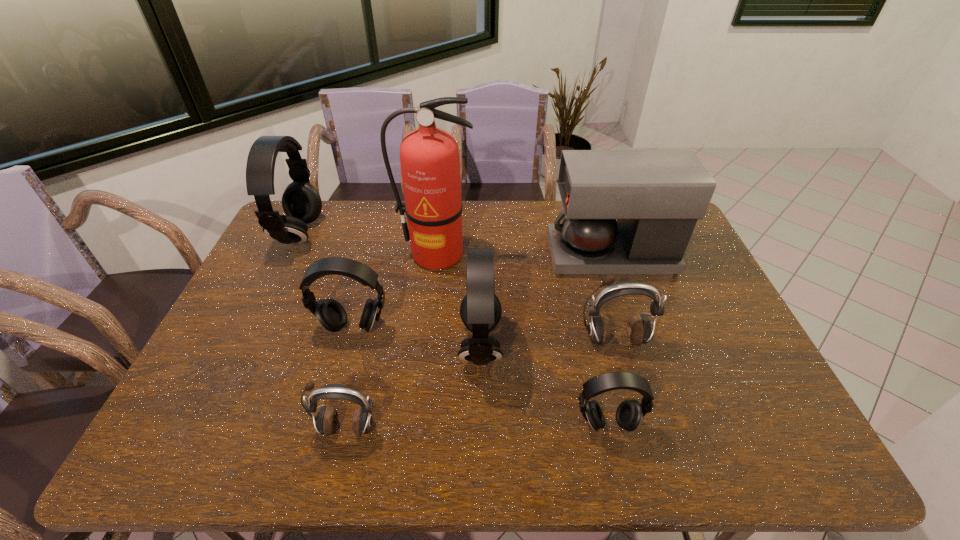
Find the location of a particular element. The height and width of the screenshot is (540, 960). black earphone that is the third closest one to the smaller brown earphone is located at coordinates (629, 413).

Identify the location of free space that satisfies the following two spatial constraints: 1. on the carafe side of the coffee maker; 2. on the ear cups of the smallest black earphone. This screenshot has height=540, width=960. (667, 423).

The width and height of the screenshot is (960, 540). Find the location of `free space that satisfies the following two spatial constraints: 1. on the ear cups of the third smallest black earphone; 2. on the ear pads of the nearer brown earphone`. free space that satisfies the following two spatial constraints: 1. on the ear cups of the third smallest black earphone; 2. on the ear pads of the nearer brown earphone is located at coordinates (481, 428).

Find the location of a particular element. The height and width of the screenshot is (540, 960). free spot that satisfies the following two spatial constraints: 1. on the ear pads of the farther brown earphone; 2. on the ear cups of the third smallest black earphone is located at coordinates (615, 345).